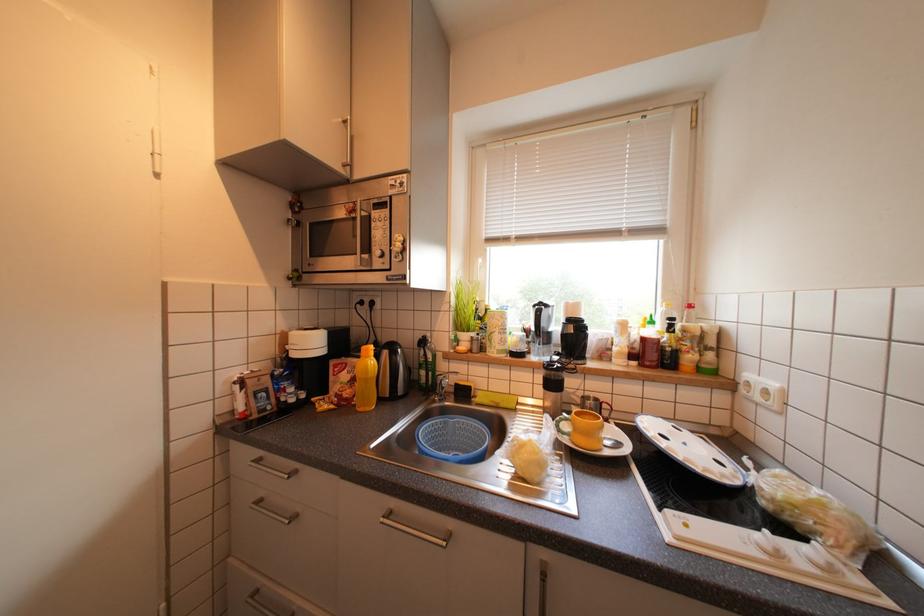
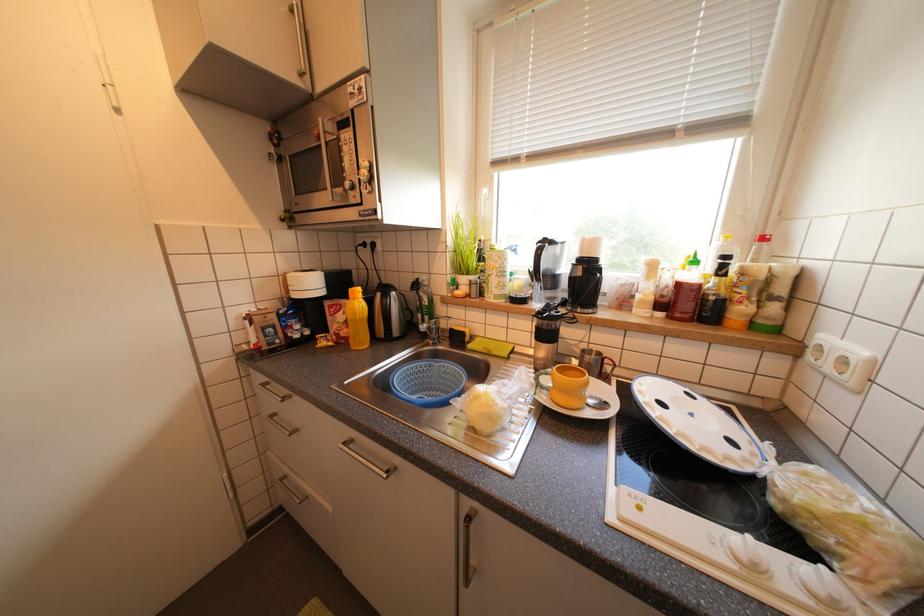
In the scene shown: The images are taken continuously from a first-person perspective. In which direction are you moving?

The cameraman moved toward right, forward.